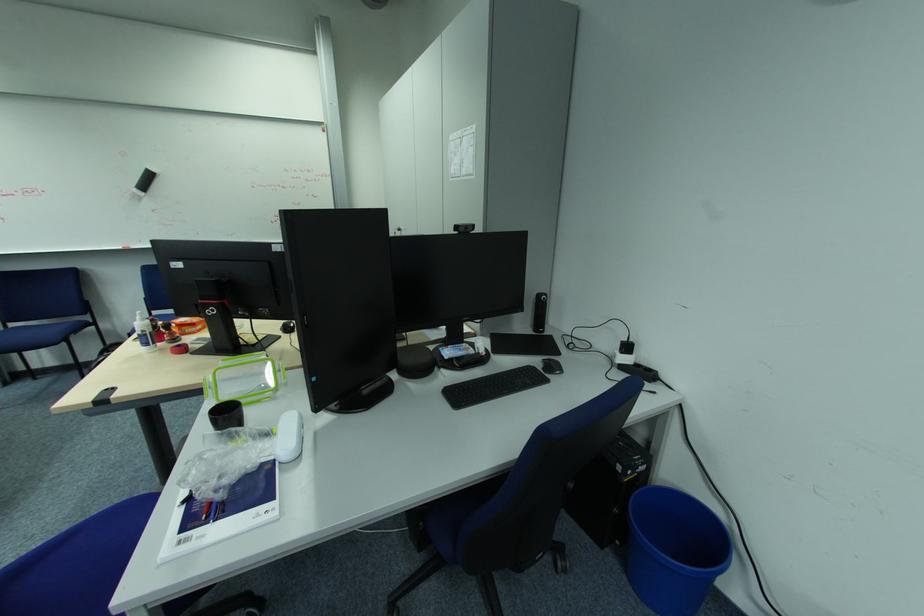
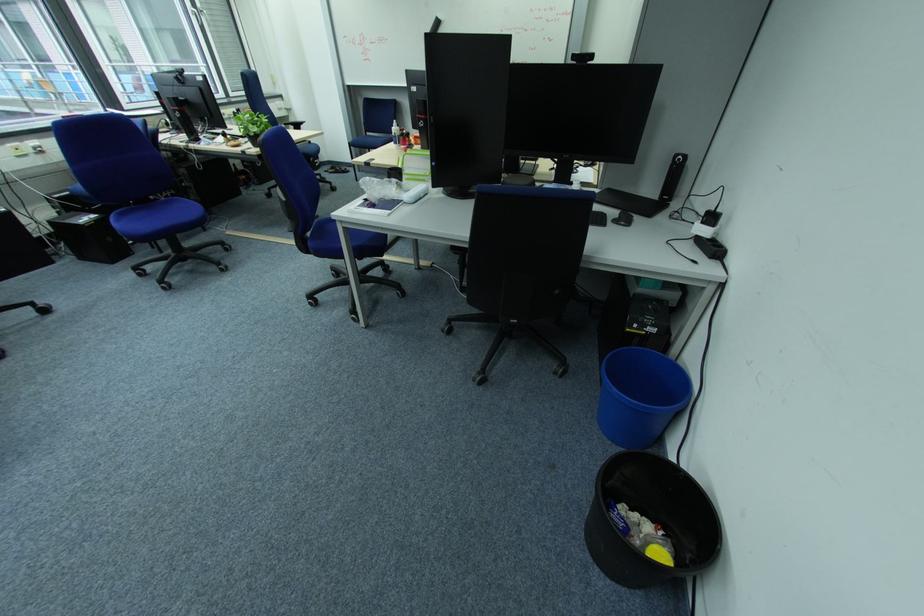
Where in the second image is the point corresponding to point 466,229 from the first image?

(581, 57)